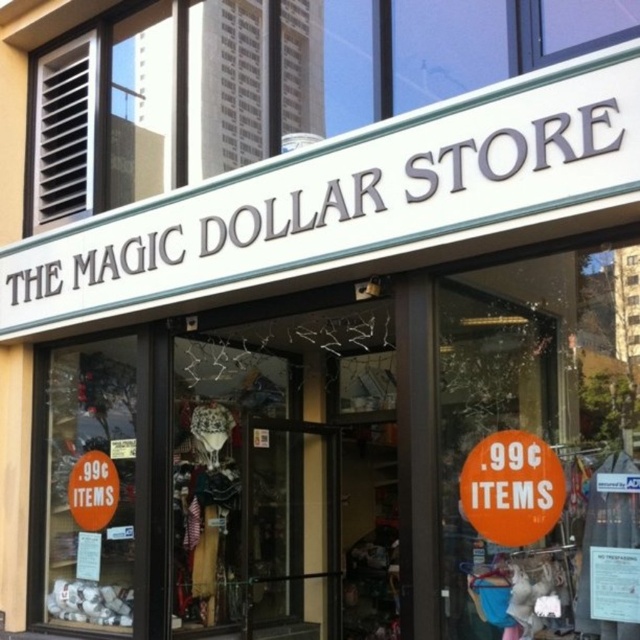
Question: Which object appears closest to the camera in this image?

Choices:
 (A) orange paper sign at lower left
 (B) orange matte sign at lower right

Answer: (B)

Question: Is orange matte sign at lower right to the right of orange paper sign at lower left from the viewer's perspective?

Choices:
 (A) no
 (B) yes

Answer: (B)

Question: Among these points, which one is farthest from the camera?

Choices:
 (A) (472, 480)
 (B) (88, 481)

Answer: (B)

Question: Is orange matte sign at lower right thinner than orange paper sign at lower left?

Choices:
 (A) yes
 (B) no

Answer: (A)

Question: Is orange matte sign at lower right to the left of orange paper sign at lower left from the viewer's perspective?

Choices:
 (A) no
 (B) yes

Answer: (A)